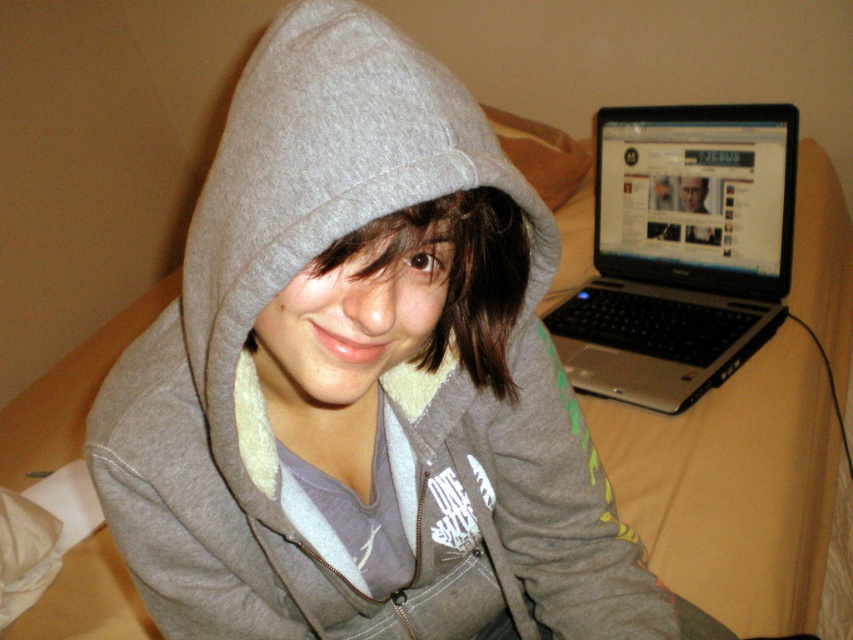
In the scene shown: Measure the distance between gray fleece hoodie at center and silver/black laptop at upper right.

The distance of gray fleece hoodie at center from silver/black laptop at upper right is 26.30 inches.

Is point (410, 168) in front of point (735, 237)?

Yes, point (410, 168) is closer to viewer.

The image size is (853, 640). What do you see at coordinates (328, 189) in the screenshot? I see `gray fleece hoodie at center` at bounding box center [328, 189].

Where is `gray fleece hoodie at center`? Image resolution: width=853 pixels, height=640 pixels. gray fleece hoodie at center is located at coordinates (328, 189).